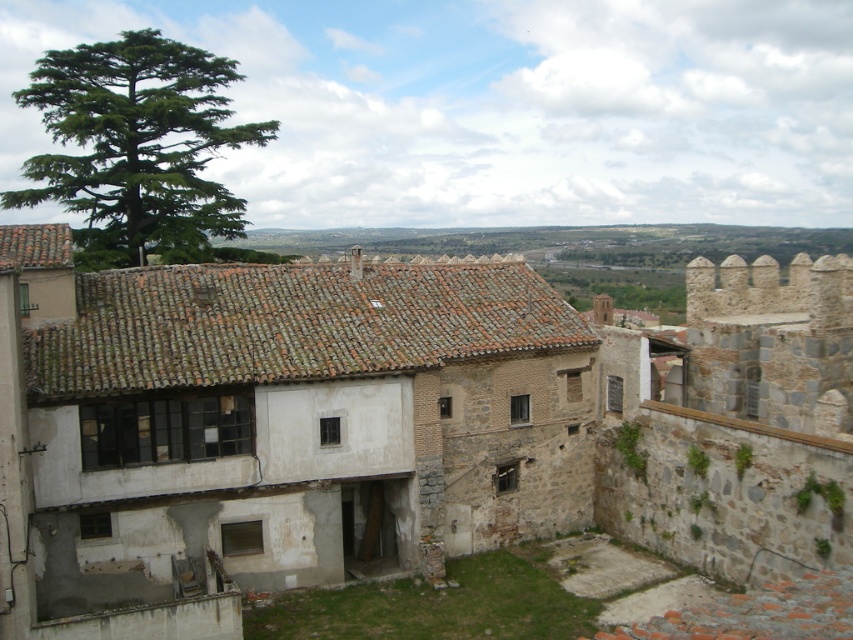
Question: Which object appears farthest from the camera in this image?

Choices:
 (A) rustic stone castle at center
 (B) green needle-like tree at upper left

Answer: (B)

Question: Can you confirm if rustic stone castle at center is thinner than green needle-like tree at upper left?

Choices:
 (A) no
 (B) yes

Answer: (B)

Question: Where is rustic stone castle at center located in relation to green needle-like tree at upper left in the image?

Choices:
 (A) below
 (B) above

Answer: (A)

Question: Is the position of rustic stone castle at center more distant than that of green needle-like tree at upper left?

Choices:
 (A) no
 (B) yes

Answer: (A)

Question: Among these points, which one is nearest to the camera?

Choices:
 (A) (322, 264)
 (B) (155, 195)

Answer: (A)